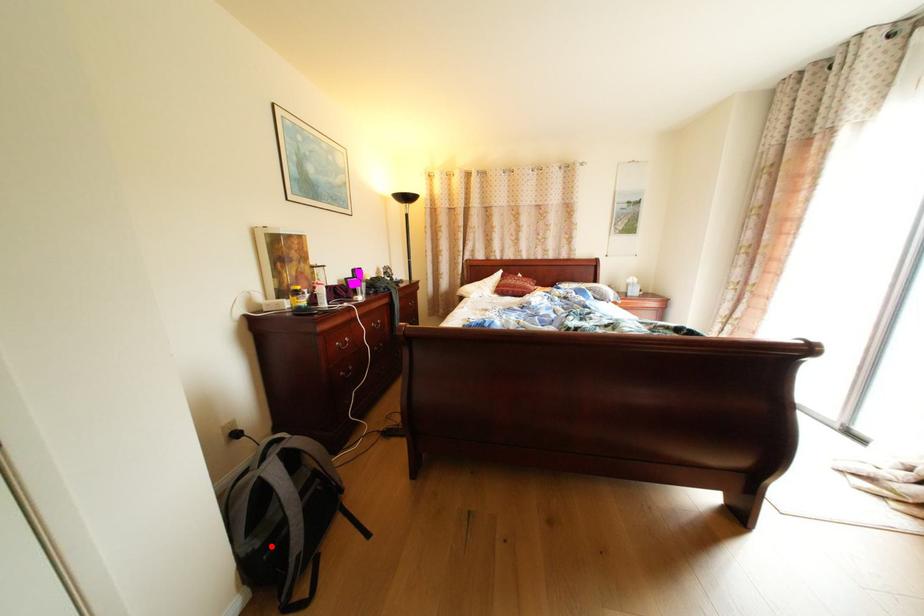
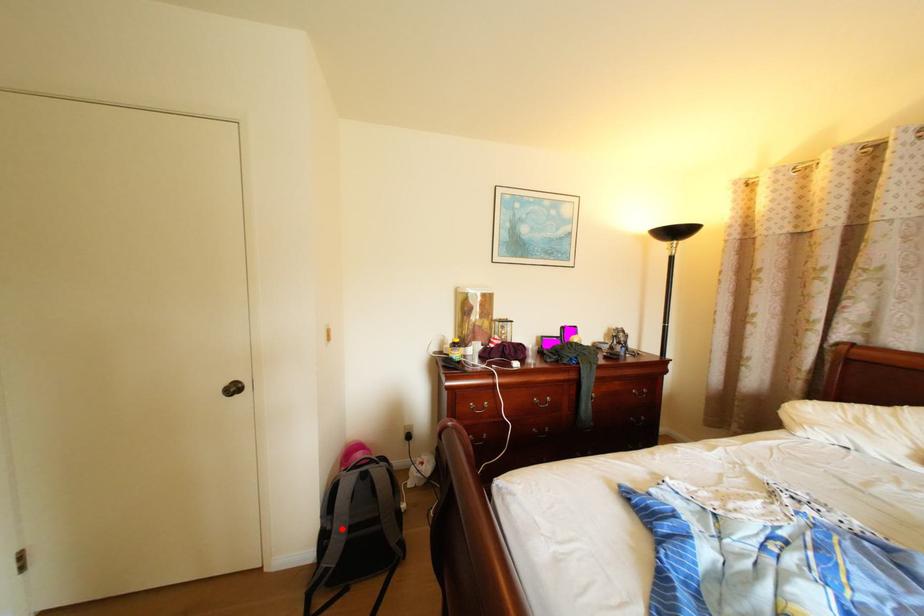
I am providing you with two images of the same scene from different viewpoints. A red point is marked on the first image and another point is marked on the second image. Is the red point in image1 aligned with the point shown in image2?

Yes